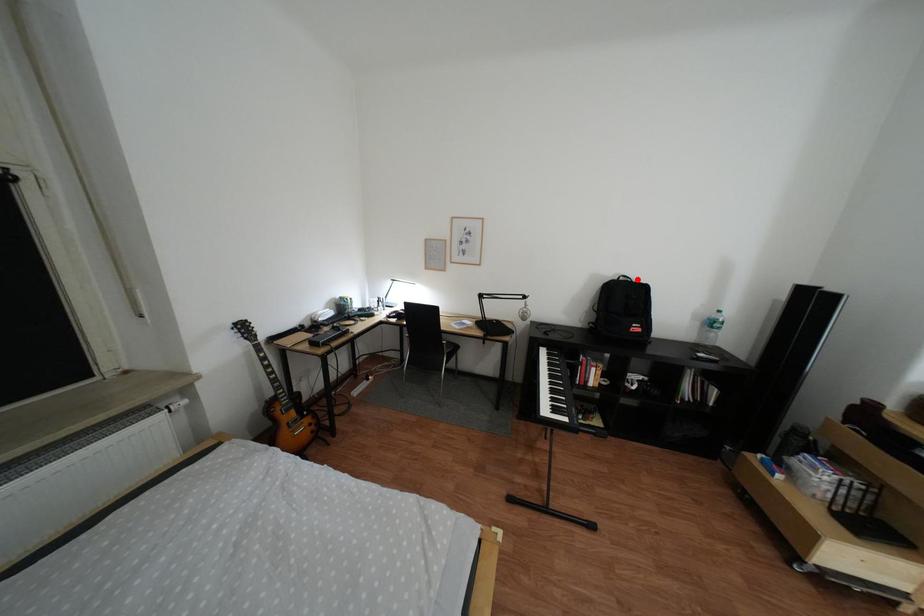
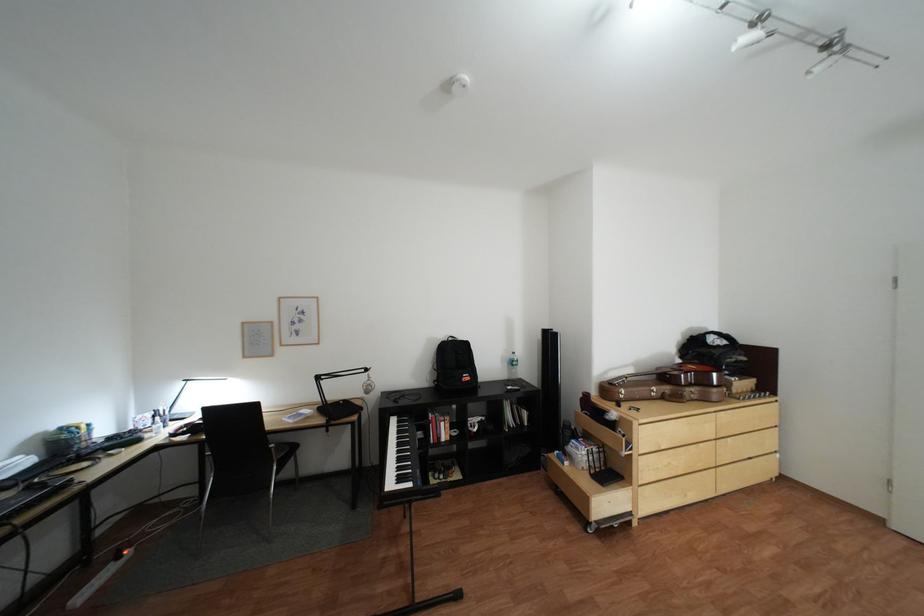
Find the pixel in the second image that matches the highlighted location in the first image.

(466, 339)